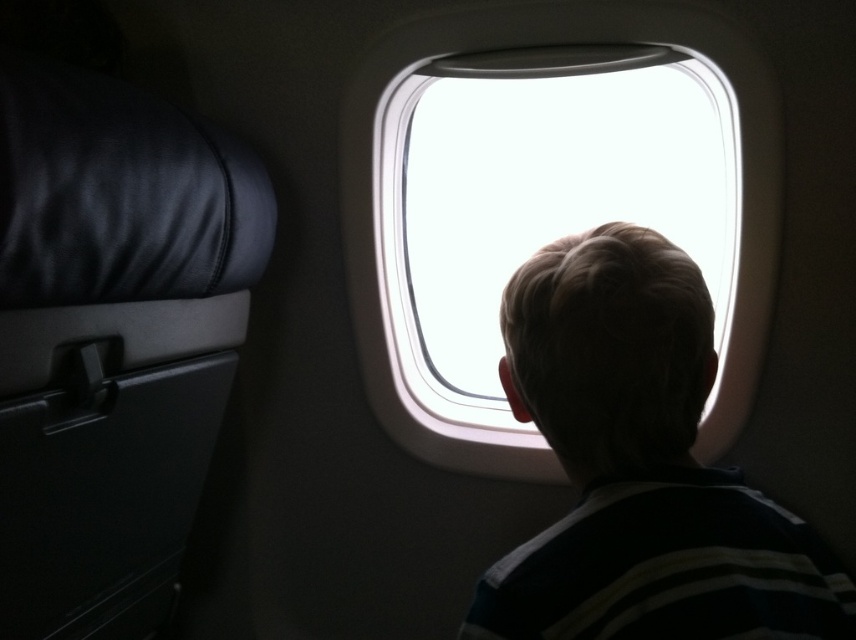
Does blonde hair at window right have a larger size compared to transparent glass airplane window at center?

Yes, blonde hair at window right is bigger than transparent glass airplane window at center.

Is point (807, 604) less distant than point (437, 173)?

Yes, point (807, 604) is closer to viewer.

The height and width of the screenshot is (640, 856). In order to click on blonde hair at window right in this screenshot , I will do `click(640, 467)`.